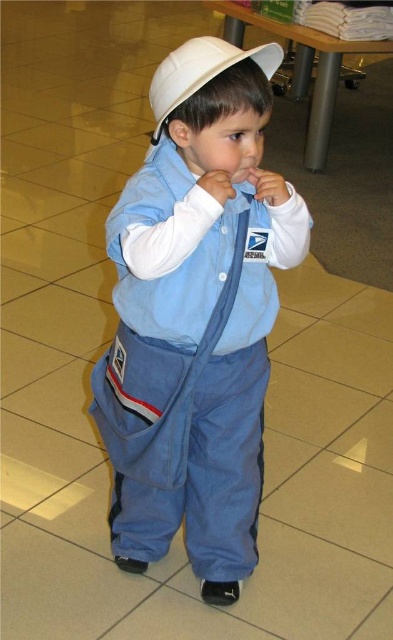
Can you confirm if blue denim jumpsuit at center is bigger than white matte baseball hat at center?

Yes.

Does blue denim jumpsuit at center have a greater height compared to white matte baseball hat at center?

Indeed, blue denim jumpsuit at center has a greater height compared to white matte baseball hat at center.

Is point (187, 424) behind point (167, 92)?

Yes, it is.

At what (x,y) coordinates should I click in order to perform the action: click on blue denim jumpsuit at center. Please return your answer as a coordinate pair (x, y). The image size is (393, 640). Looking at the image, I should click on (196, 316).